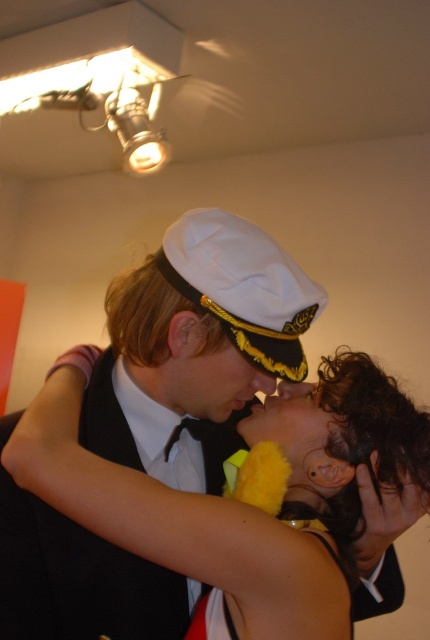
You are standing in front of the image and want to locate the matte yellow fabric at center. Where exactly is it positioned in the image?

The matte yellow fabric at center is located at point coordinates of (178, 524).

You are a photographer adjusting your camera focus. You notice two points in the image at coordinates point (266, 374) and point (322, 451). Which point should you focus on first if you want to capture the closest object to the camera?

Point (266, 374) is further to the camera than point (322, 451), so you should focus on point (266, 374) first as it is closer to the camera.